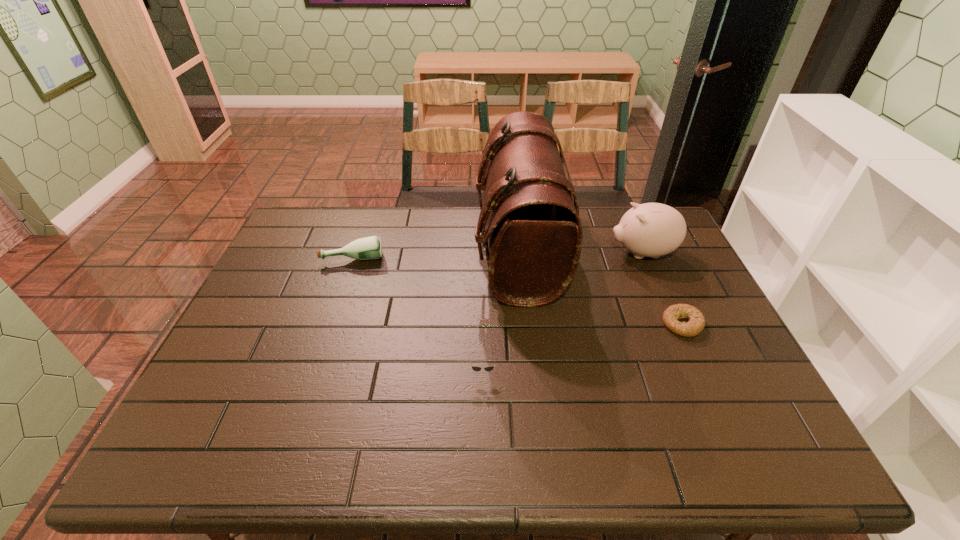
Locate an element on the screen. vacant space located at the snout of the piggy bank is located at coordinates (513, 253).

Where is `vacant space located 0.300m at the snout of the piggy bank`? vacant space located 0.300m at the snout of the piggy bank is located at coordinates (516, 253).

Where is `vacant space situated 0.080m at the snout of the piggy bank`? Image resolution: width=960 pixels, height=540 pixels. vacant space situated 0.080m at the snout of the piggy bank is located at coordinates (584, 253).

This screenshot has height=540, width=960. What are the coordinates of `blank space located on the front of the third tallest object` in the screenshot? It's located at (329, 329).

You are a GUI agent. You are given a task and a screenshot of the screen. Output one action in this format:
    pyautogui.click(x=<x>, y=<y>)
    Task: Click on the blank area located in front of the lenses of the sunglasses
    The width and height of the screenshot is (960, 540).
    Given the screenshot: What is the action you would take?
    pyautogui.click(x=483, y=408)

The image size is (960, 540). Identify the location of vacant space located on the left of the shortest object. (549, 324).

Identify the location of satchel at the far edge. (533, 229).

The height and width of the screenshot is (540, 960). What are the coordinates of `piggy bank positioned at the far edge` in the screenshot? It's located at (652, 230).

The width and height of the screenshot is (960, 540). Identify the location of object located at the left edge. (368, 248).

Where is `piggy bank that is at the right edge`? The height and width of the screenshot is (540, 960). piggy bank that is at the right edge is located at coordinates pyautogui.click(x=652, y=230).